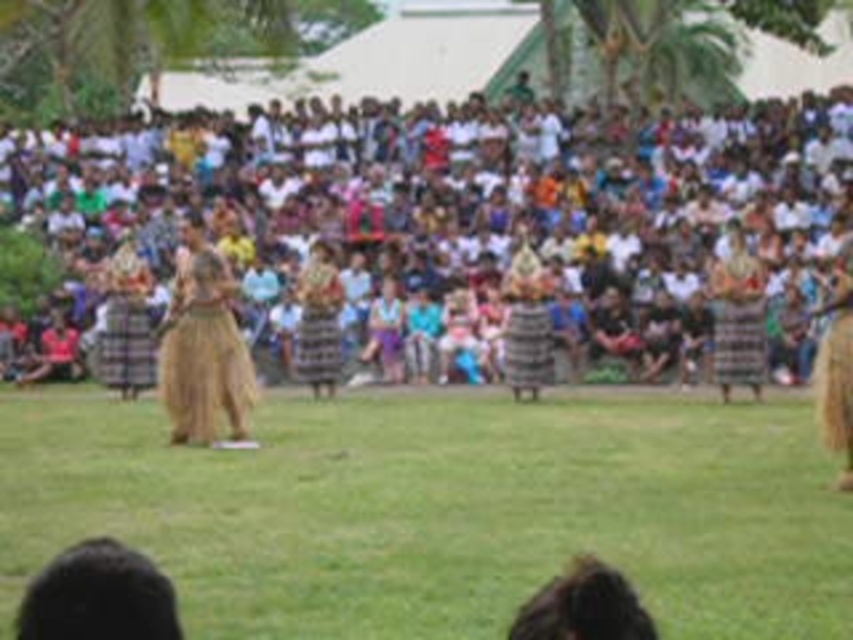
Can you confirm if green grass at center is shorter than textured woven skirt at center?

Indeed, green grass at center has a lesser height compared to textured woven skirt at center.

How far apart are green grass at center and textured woven skirt at center?

green grass at center is 7.54 meters away from textured woven skirt at center.

Identify the location of green grass at center. (440, 508).

You are a GUI agent. You are given a task and a screenshot of the screen. Output one action in this format:
    pyautogui.click(x=<x>, y=<y>)
    Task: Click on the green grass at center
    This screenshot has width=853, height=640.
    Given the screenshot: What is the action you would take?
    pyautogui.click(x=440, y=508)

Who is positioned more to the left, textured brown skirt at right or brown woven skirt at right?

textured brown skirt at right

Does textured brown skirt at right appear on the right side of brown woven skirt at right?

No, textured brown skirt at right is not to the right of brown woven skirt at right.

Is point (711, 282) positioned in front of point (830, 356)?

No, it is not.

Locate an element on the screen. textured brown skirt at right is located at coordinates (738, 317).

Can you confirm if plaid fabric skirt at left is smaller than brown woven skirt at right?

Indeed, plaid fabric skirt at left has a smaller size compared to brown woven skirt at right.

Who is more forward, [131,269] or [846,381]?

Point [846,381] is more forward.

This screenshot has width=853, height=640. I want to click on plaid fabric skirt at left, so click(x=126, y=324).